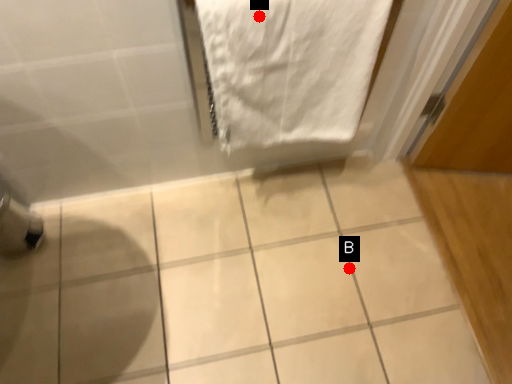
Question: Two points are circled on the image, labeled by A and B beside each circle. Which of the following is the closest to the observer?

Choices:
 (A) A is closer
 (B) B is closer

Answer: (A)